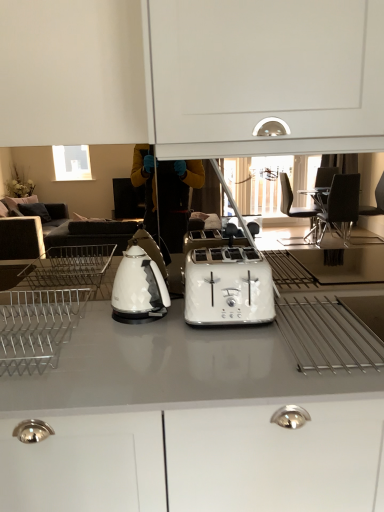
This screenshot has width=384, height=512. What are the coordinates of `free point to the left of white glossy electric kettle at left` in the screenshot? It's located at (93, 312).